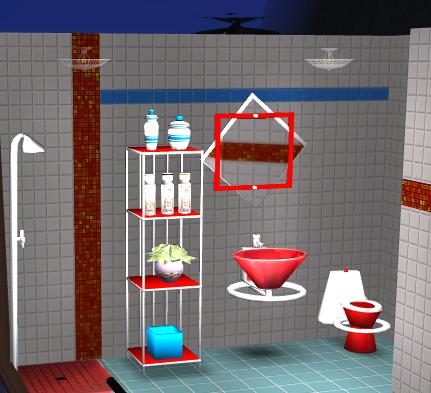
Find the location of a particular element. This screenshot has width=431, height=393. pot is located at coordinates (174, 269).